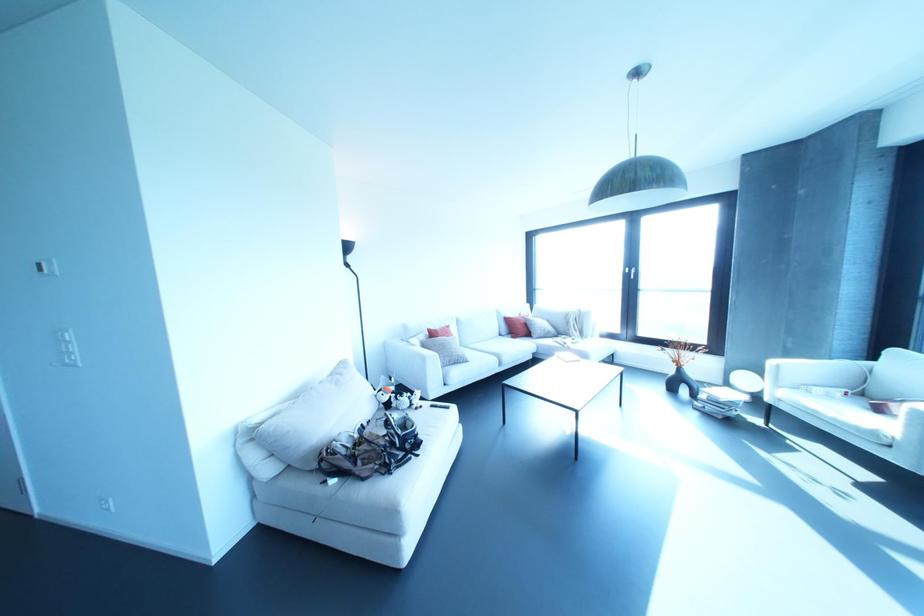
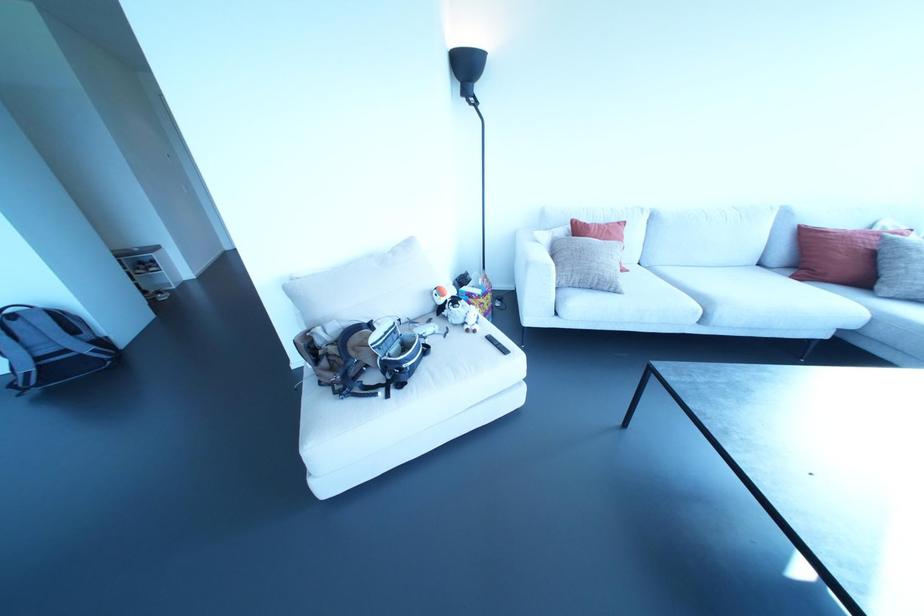
Where in the second image is the point corresponding to (x=416, y=408) from the first image?

(467, 330)